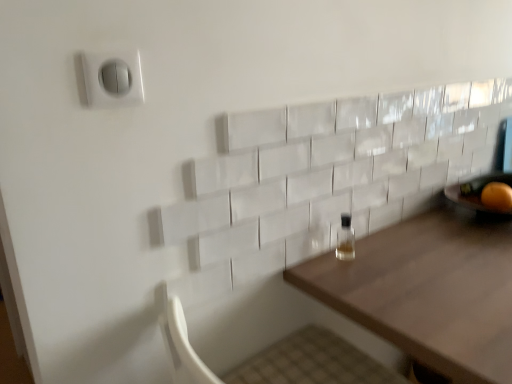
Where is `vacant space that is in between clear glass bottle at center and orange matte at right`? The height and width of the screenshot is (384, 512). vacant space that is in between clear glass bottle at center and orange matte at right is located at coordinates (438, 232).